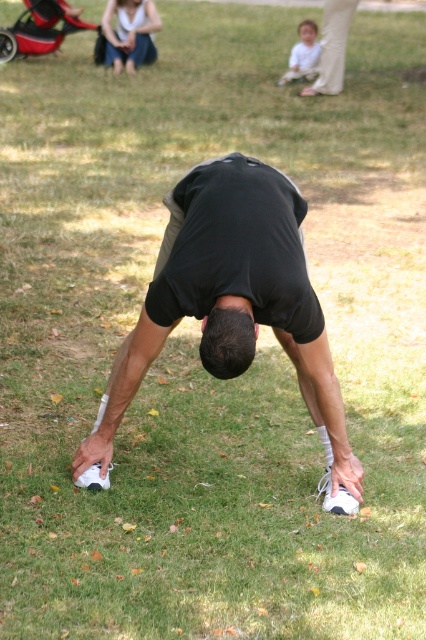
Can you confirm if white cotton shirt at upper left is positioned to the right of red plastic baby carriage at upper left?

Correct, you'll find white cotton shirt at upper left to the right of red plastic baby carriage at upper left.

Locate an element on the screen. white cotton shirt at upper left is located at coordinates (129, 33).

At what (x,y) coordinates should I click in order to perform the action: click on white cotton shirt at upper left. Please return your answer as a coordinate pair (x, y). Looking at the image, I should click on (129, 33).

Is black matte shorts at center positioned at the back of white cotton shirt at upper left?

That is False.

Who is more distant from viewer, (235, 154) or (109, 20)?

The point (109, 20) is behind.

The height and width of the screenshot is (640, 426). Identify the location of black matte shorts at center. (232, 298).

Who is shorter, black matte shorts at center or red plastic baby carriage at upper left?

red plastic baby carriage at upper left

Measure the distance between black matte shorts at center and red plastic baby carriage at upper left.

black matte shorts at center is 11.73 meters from red plastic baby carriage at upper left.

Which is behind, point (296, 314) or point (97, 29)?

Positioned behind is point (97, 29).

This screenshot has width=426, height=640. I want to click on black matte shorts at center, so tap(232, 298).